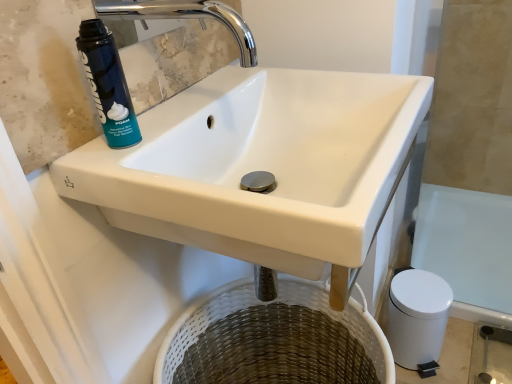
Identify the location of free location in front of blue matte shaving cream can at upper left. (146, 182).